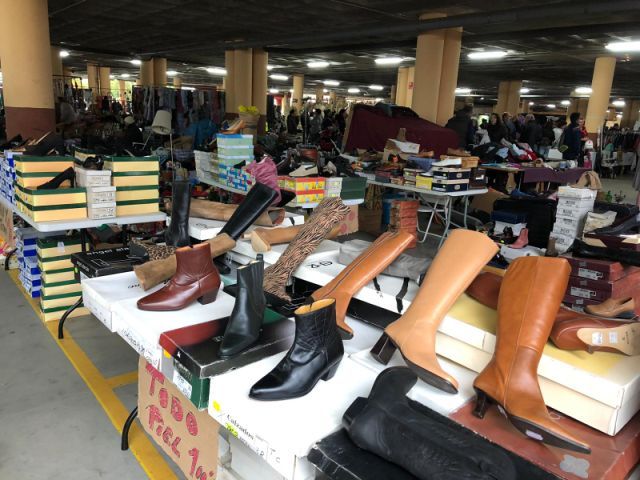
I want to click on lamp, so click(x=163, y=112).